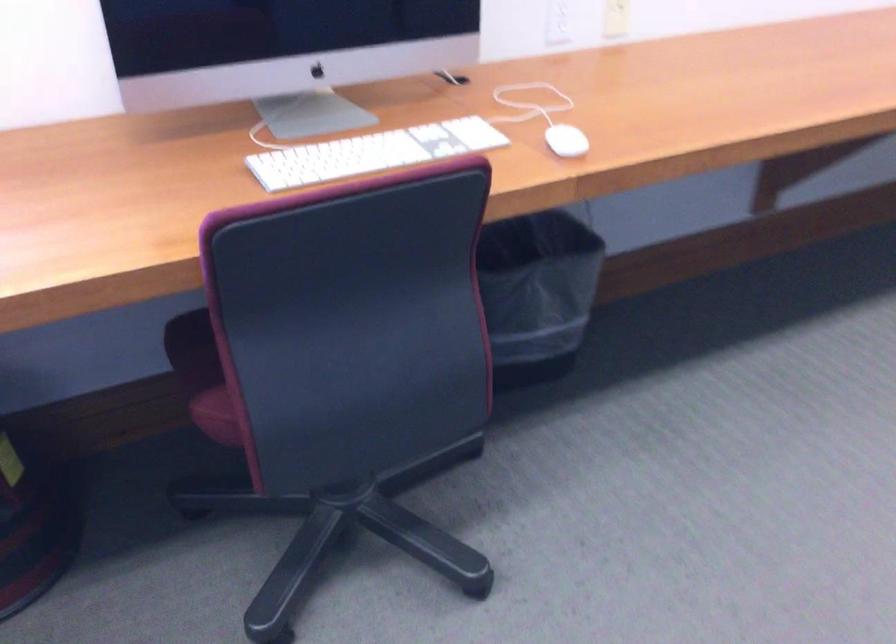
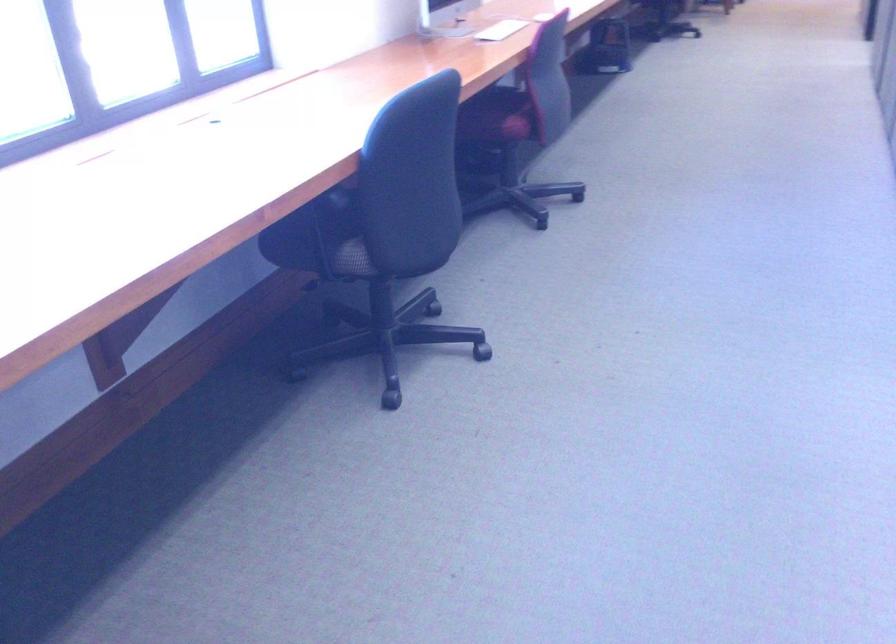
The point at [209,377] is marked in the first image. Where is the corresponding point in the second image?

(497, 116)